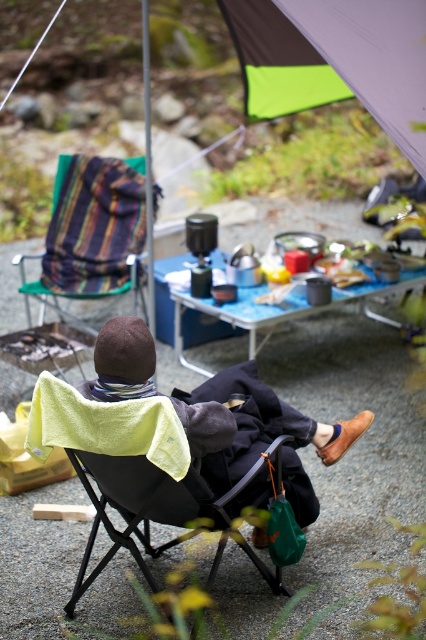
You are setting up a campsite and need to place a tent between the black fabric chair at center and the blue fabric picnic table at center. According to the scene, which object should the tent be placed closer to?

The black fabric chair at center is positioned on the left side of the blue fabric picnic table at center, so the tent should be placed closer to the blue fabric picnic table at center to maintain the spatial arrangement.